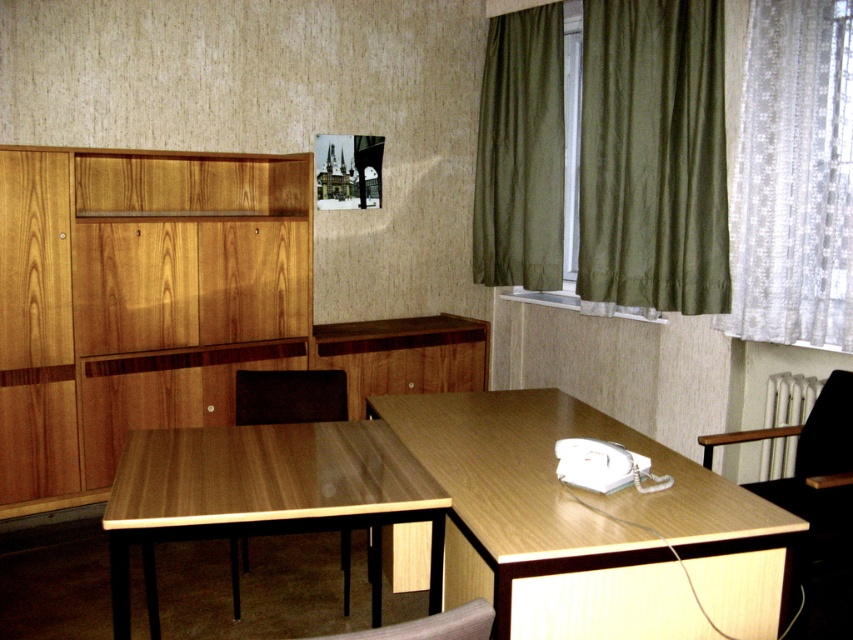
Question: Considering the real-world distances, which object is farthest from the olive green fabric curtain at upper right?

Choices:
 (A) wooden cabinet at left
 (B) white lace curtain at right

Answer: (A)

Question: Which point is farther to the camera?

Choices:
 (A) (566, 244)
 (B) (804, 627)
 (C) (473, 490)

Answer: (A)

Question: Is white lace curtain at right below olive green fabric curtain at upper right?

Choices:
 (A) yes
 (B) no

Answer: (A)

Question: Can you confirm if wooden table at lower right is bigger than olive green fabric curtain at right?

Choices:
 (A) no
 (B) yes

Answer: (B)

Question: Can you confirm if wooden cabinet at left is bigger than wooden table at lower right?

Choices:
 (A) no
 (B) yes

Answer: (B)

Question: Among these points, which one is nearest to the camera?

Choices:
 (A) (573, 28)
 (B) (480, 253)

Answer: (A)